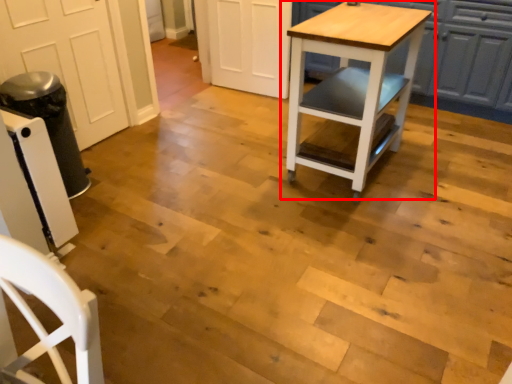
Question: From the image's perspective, what is the correct spatial relationship of table (annotated by the red box) in relation to cabinetry?

Choices:
 (A) above
 (B) below

Answer: (B)